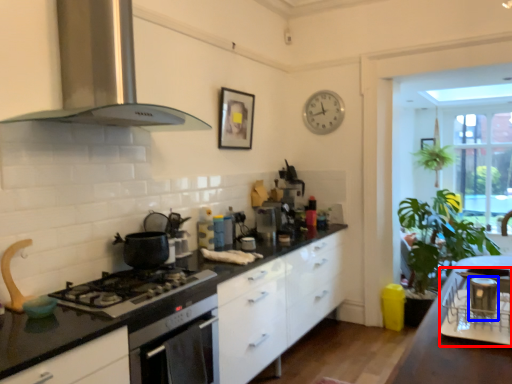
Question: Among these objects, which one is nearest to the camera, appliance (highlighted by a red box) or appliance (highlighted by a blue box)?

Choices:
 (A) appliance
 (B) appliance

Answer: (A)